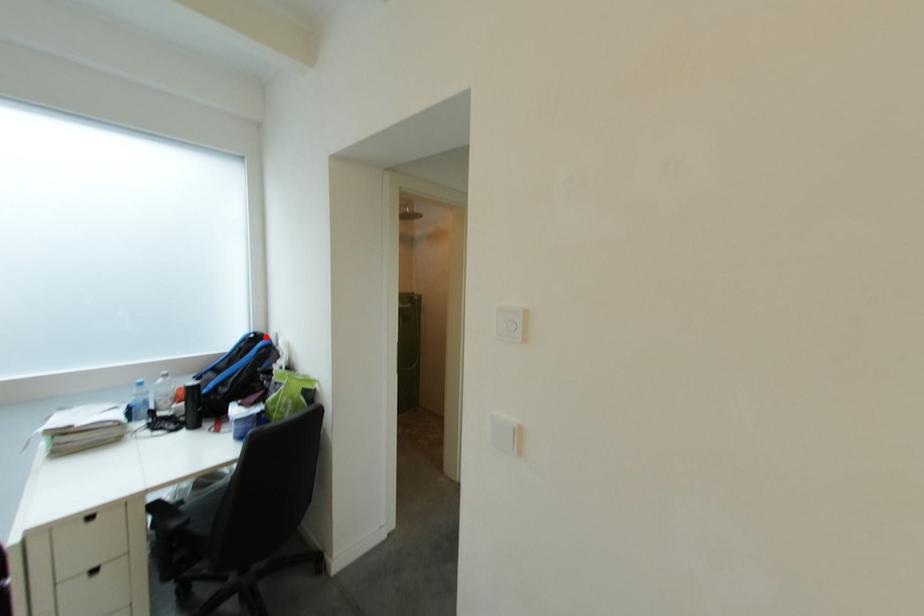
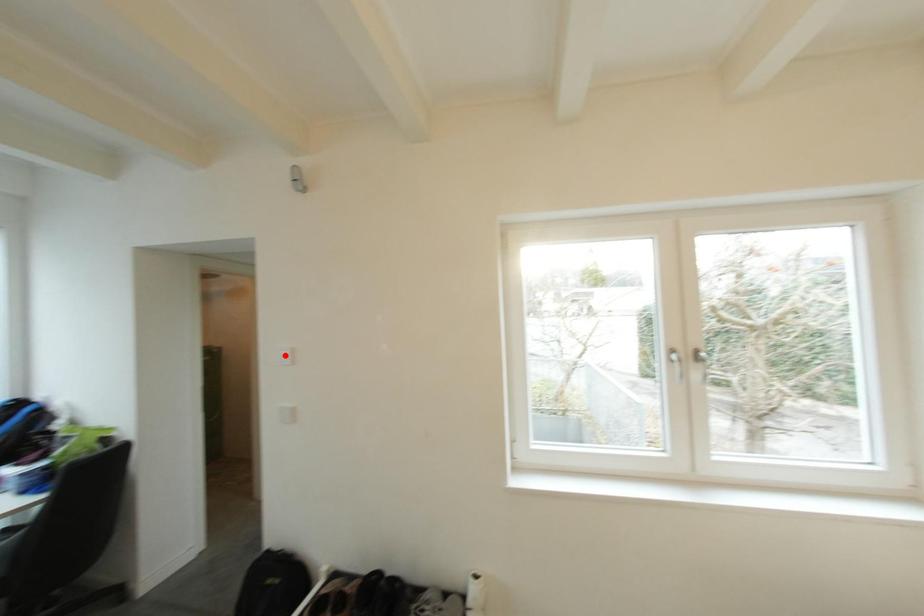
I am providing you with two images of the same scene from different viewpoints. A red point is marked on the first image and another point is marked on the second image. Do the highlighted points in image1 and image2 indicate the same real-world spot?

No